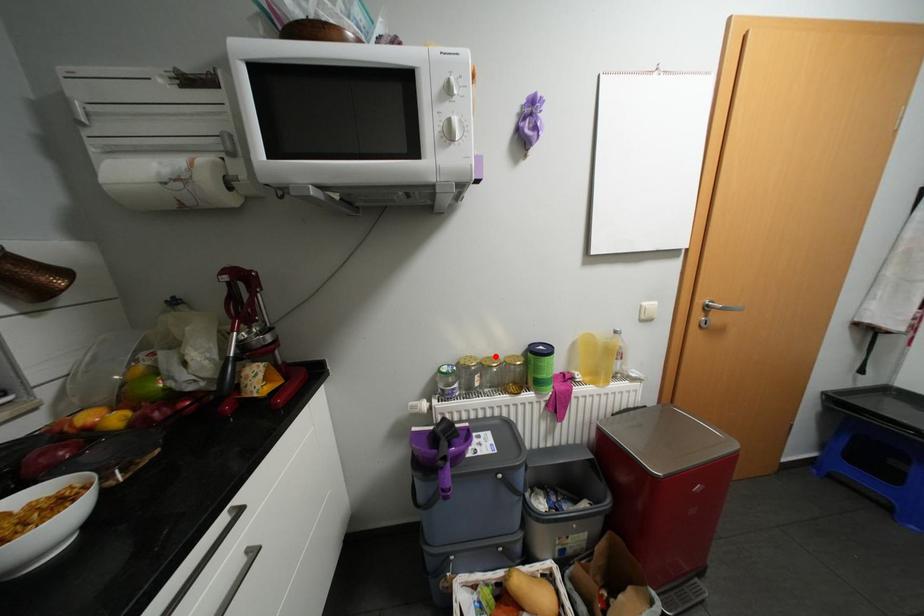
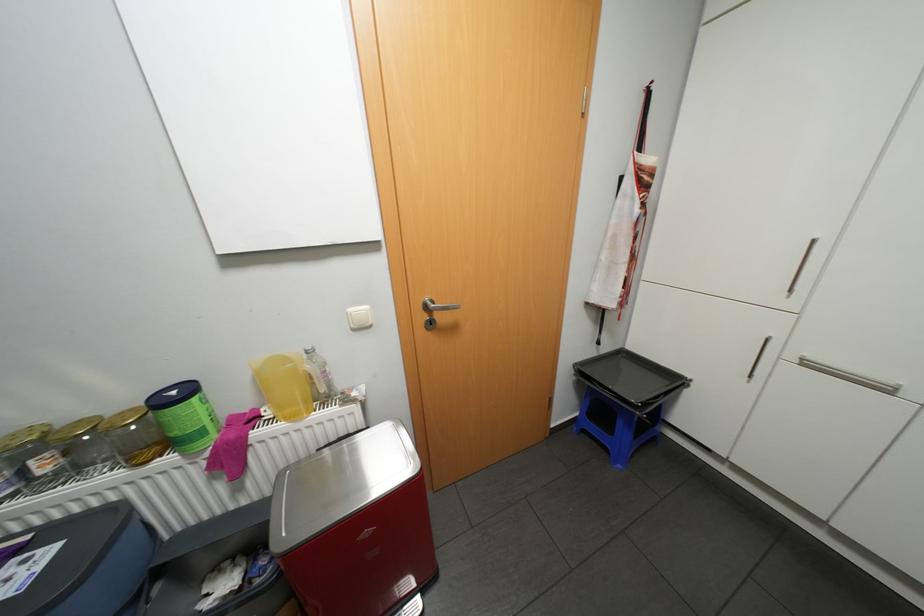
The point at the highlighted location is marked in the first image. Where is the corresponding point in the second image?

(88, 419)